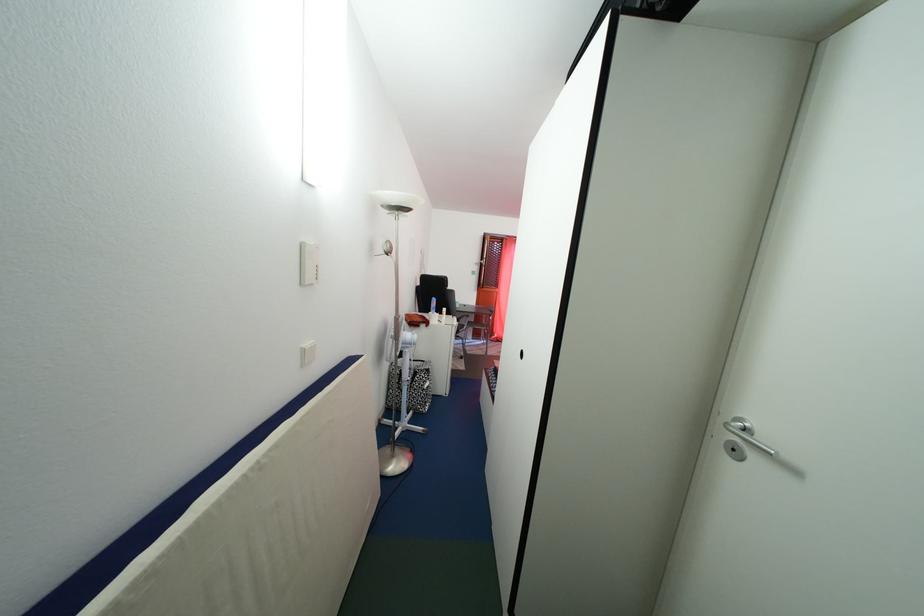
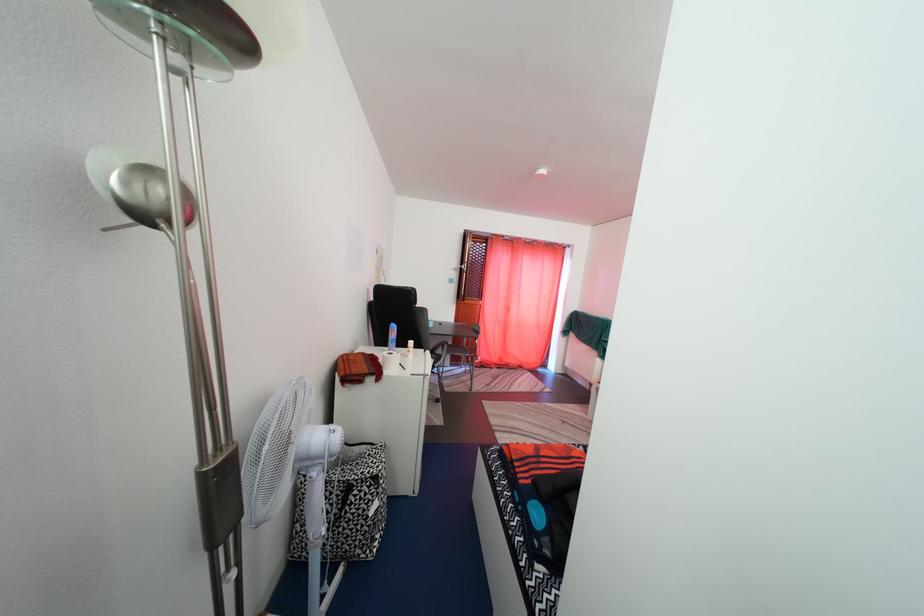
Find the pixel in the second image that matches (x=436, y=377) in the first image.

(384, 485)